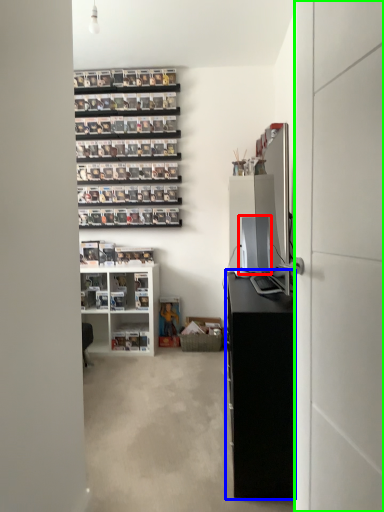
Question: Considering the real-world distances, which object is closest to desktop computer (highlighted by a red box)? cabinetry (highlighted by a blue box) or glass door (highlighted by a green box).

Choices:
 (A) cabinetry
 (B) glass door

Answer: (A)